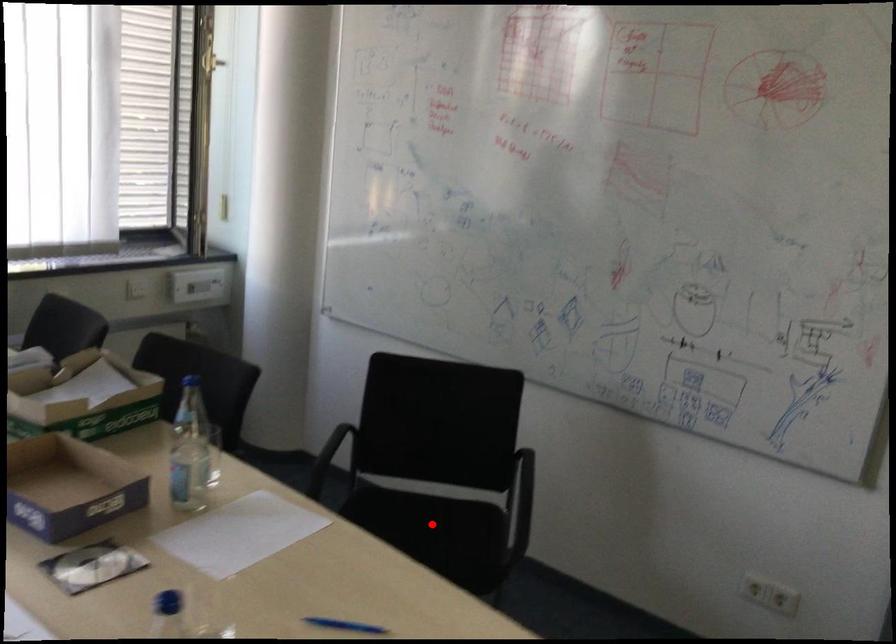
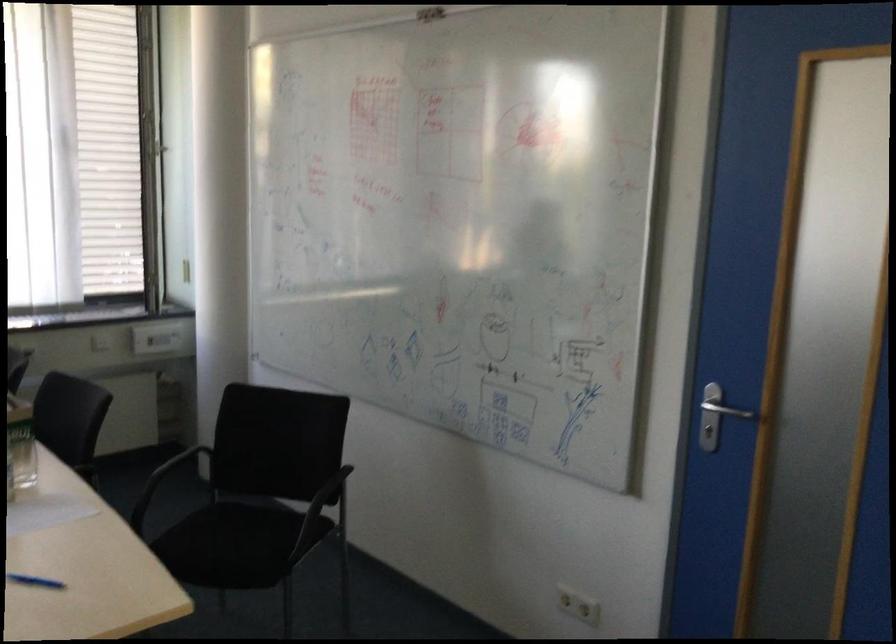
Question: I am providing you with two images of the same scene from different viewpoints. Image1 has a red point marked. In image2, the corresponding 3D location appears at what relative position? Reply with the corresponding letter.

Choices:
 (A) Closer
 (B) Farther

Answer: (B)